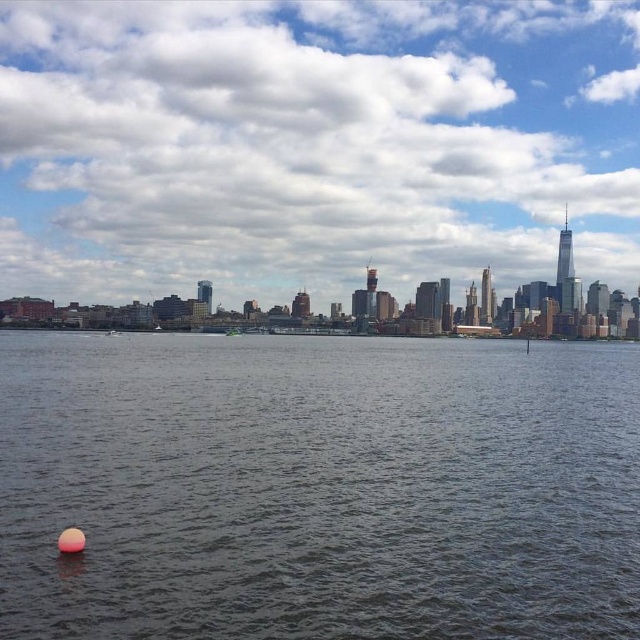
Which is more to the left, dark gray water at lower left or green plastic boat at center?

Positioned to the left is green plastic boat at center.

The width and height of the screenshot is (640, 640). What are the coordinates of `dark gray water at lower left` in the screenshot? It's located at (317, 486).

Identify the location of dark gray water at lower left. Image resolution: width=640 pixels, height=640 pixels. (317, 486).

Describe the element at coordinates (317, 486) in the screenshot. Image resolution: width=640 pixels, height=640 pixels. I see `dark gray water at lower left` at that location.

Locate an element on the screen. The height and width of the screenshot is (640, 640). dark gray water at lower left is located at coordinates (317, 486).

Is blue sky at upper center positioned behind green plastic boat at center?

Yes, it is.

Is point (428, 195) positioned after point (234, 333)?

Yes, point (428, 195) is farther from viewer.

Where is `blue sky at upper center`? blue sky at upper center is located at coordinates (312, 145).